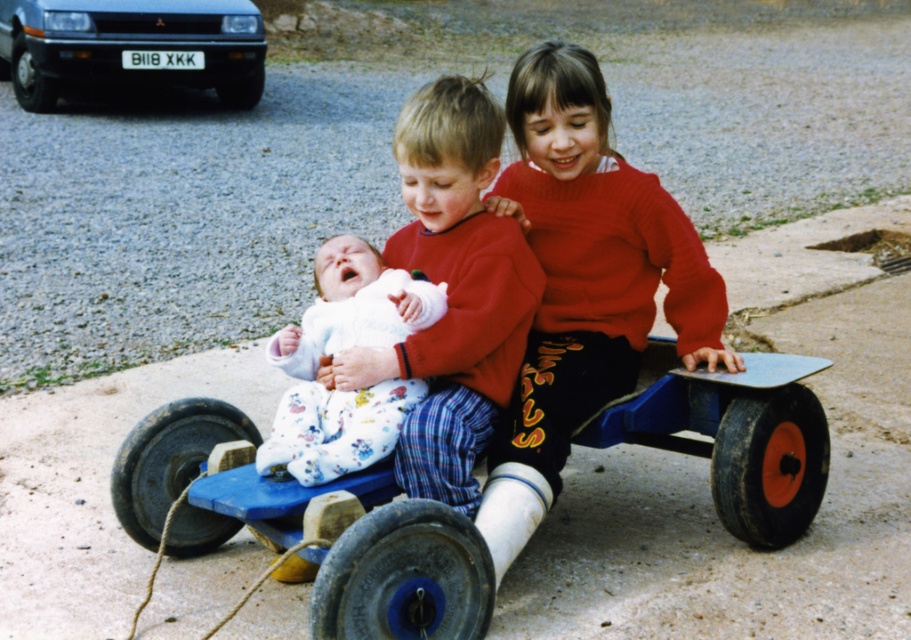
Does blue plastic wagon at center appear on the left side of knitted red sweater at center?

Correct, you'll find blue plastic wagon at center to the left of knitted red sweater at center.

Is the position of blue plastic wagon at center less distant than that of knitted red sweater at center?

Yes, blue plastic wagon at center is closer to the viewer.

Which is behind, point (446, 612) or point (602, 116)?

Point (602, 116)

Image resolution: width=911 pixels, height=640 pixels. Identify the location of blue plastic wagon at center. (356, 554).

In the scene shown: Can you confirm if flannel pajama pants at center is bigger than silver metallic car at upper left?

No.

In the scene shown: Between flannel pajama pants at center and silver metallic car at upper left, which one appears on the right side from the viewer's perspective?

Positioned to the right is flannel pajama pants at center.

Where is `flannel pajama pants at center`? Image resolution: width=911 pixels, height=640 pixels. flannel pajama pants at center is located at coordinates (451, 291).

Is flannel pajama pants at center positioned behind white fleece baby at center?

Yes, it is behind white fleece baby at center.

Can you confirm if flannel pajama pants at center is smaller than white fleece baby at center?

No, flannel pajama pants at center is not smaller than white fleece baby at center.

This screenshot has width=911, height=640. Identify the location of flannel pajama pants at center. point(451,291).

The width and height of the screenshot is (911, 640). What are the coordinates of `flannel pajama pants at center` in the screenshot? It's located at (451, 291).